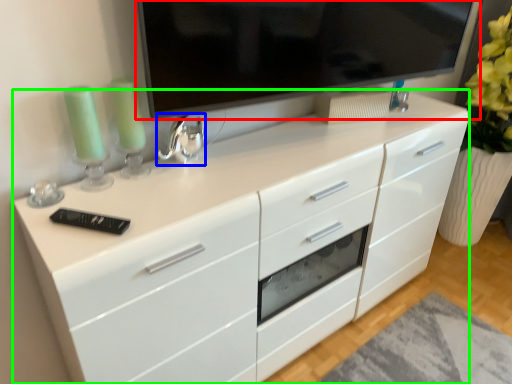
Question: Considering the real-world distances, which object is closest to television (highlighted by a red box)? appliance (highlighted by a blue box) or chest of drawers (highlighted by a green box).

Choices:
 (A) appliance
 (B) chest of drawers

Answer: (A)